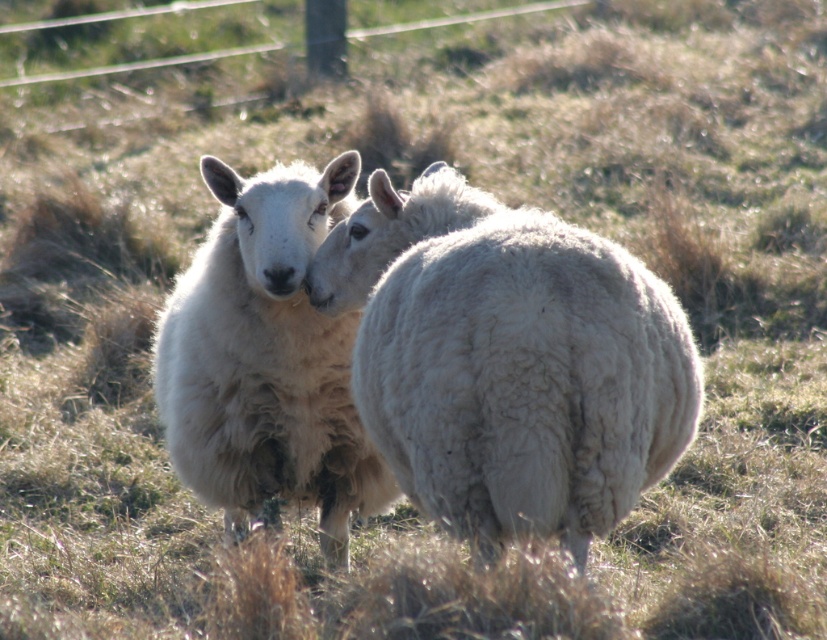
From the picture: You are a farmer who wants to place a feeding trough exactly at the center of the field. The field is represented by a coordinate system where the bottom left corner is the origin point. You see the white woolly sheep at center. Can you determine if the sheep is positioned exactly at the center of the field?

The white woolly sheep at center is located at coordinates point (508, 360), which is close to the center but not exactly at the exact center point of the field. Therefore, the sheep is not positioned exactly at the center of the field.

You are a farmer trying to fit both the white woolly sheep at center and the white woolen sheep at center into a small pen. Based on their sizes, which sheep will require more space in the pen?

The white woolen sheep at center requires more space because it occupies more space than the white woolly sheep at center.